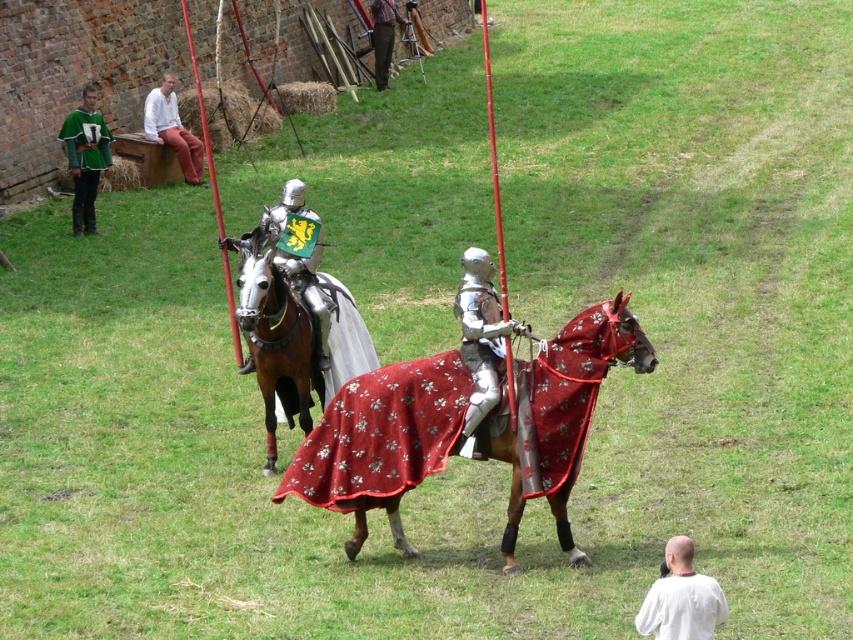
Based on the photo, does polished silver armor at center have a lesser width compared to green wool sweater at upper left?

Yes, polished silver armor at center is thinner than green wool sweater at upper left.

Is polished silver armor at center positioned behind green wool sweater at upper left?

That is False.

You are a GUI agent. You are given a task and a screenshot of the screen. Output one action in this format:
    pyautogui.click(x=<x>, y=<y>)
    Task: Click on the polished silver armor at center
    This screenshot has height=640, width=853.
    Given the screenshot: What is the action you would take?
    pyautogui.click(x=480, y=340)

You are a GUI agent. You are given a task and a screenshot of the screen. Output one action in this format:
    pyautogui.click(x=<x>, y=<y>)
    Task: Click on the polished silver armor at center
    The height and width of the screenshot is (640, 853).
    Given the screenshot: What is the action you would take?
    pyautogui.click(x=480, y=340)

Is point (85, 104) positioned before point (78, 161)?

No, it is not.

Consider the image. Measure the distance between point (80, 148) and camera.

They are 71.47 feet apart.

Which is in front, point (160, 141) or point (93, 216)?

Point (93, 216) is in front.

The width and height of the screenshot is (853, 640). In order to click on green jersey at left in this screenshot , I will do `click(84, 160)`.

Is green jersey at left to the left of white matte shirt at lower right from the viewer's perspective?

Yes, green jersey at left is to the left of white matte shirt at lower right.

Is green jersey at left below white matte shirt at lower right?

No.

Between point (190, 166) and point (701, 584), which one is positioned in front?

Positioned in front is point (701, 584).

Find the location of a particular element. green jersey at left is located at coordinates (84, 160).